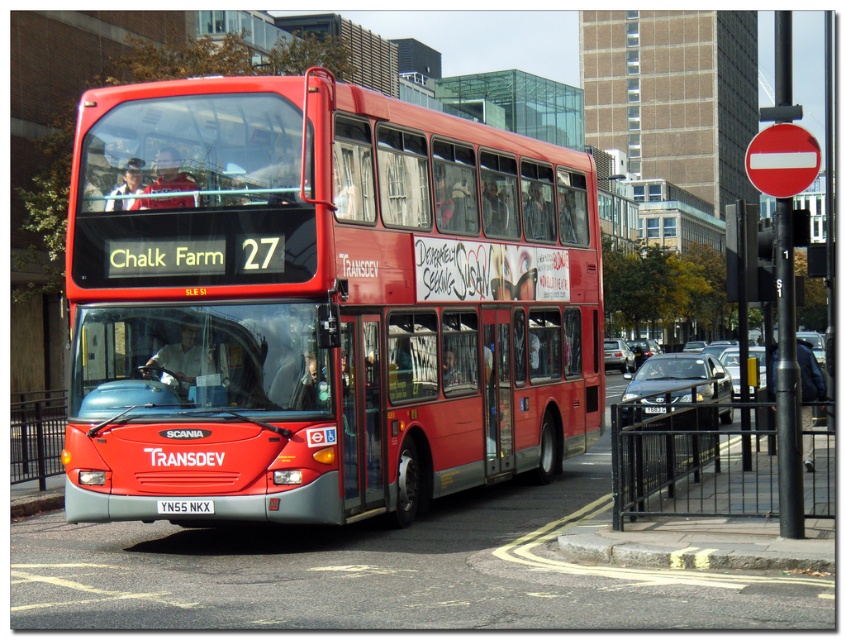
You are a delivery person needing to place a small box on either the black metal fence at lower right or the red plastic circle at upper right. Which object can you place the box on without it falling off, considering their heights?

The black metal fence at lower right is taller than the red plastic circle at upper right, so the box can be placed on the black metal fence at lower right without falling off.

You are standing at the center of the image and want to walk towards the black metal fence at lower right. In which direction should you move?

You should move towards the lower right direction to reach the black metal fence at lower right, as it is located at point (691,460) which is in the lower right quadrant of the image.

You are a pedestrian standing on the street looking at the matte red bus at center and the yellow metallic license plate at center. Which object is positioned higher from the ground?

The matte red bus at center is located above the yellow metallic license plate at center, so the matte red bus at center is positioned higher from the ground.